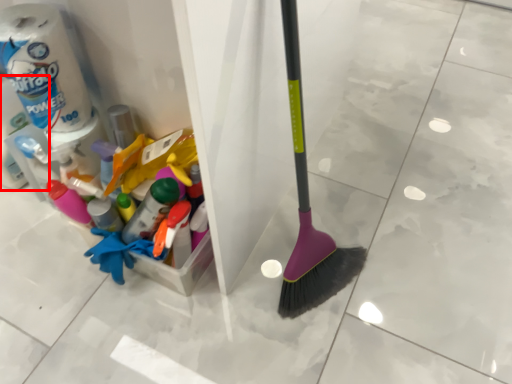
Question: Considering the relative positions of toilet paper (annotated by the red box) and toilet paper in the image provided, where is toilet paper (annotated by the red box) located with respect to the staircase?

Choices:
 (A) right
 (B) left

Answer: (B)